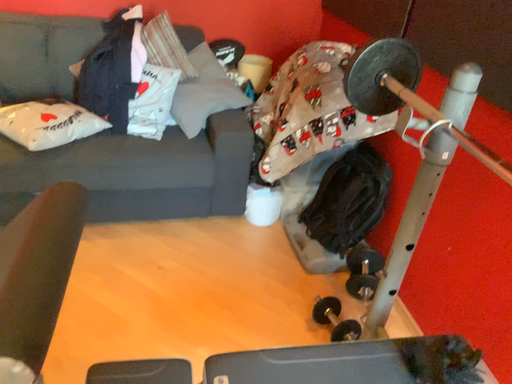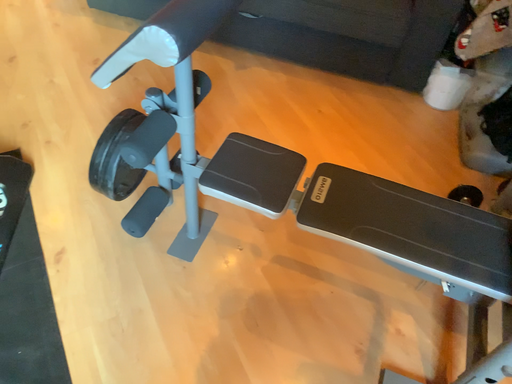
Question: Which way did the camera rotate in the video?

Choices:
 (A) rotated left
 (B) rotated right

Answer: (A)